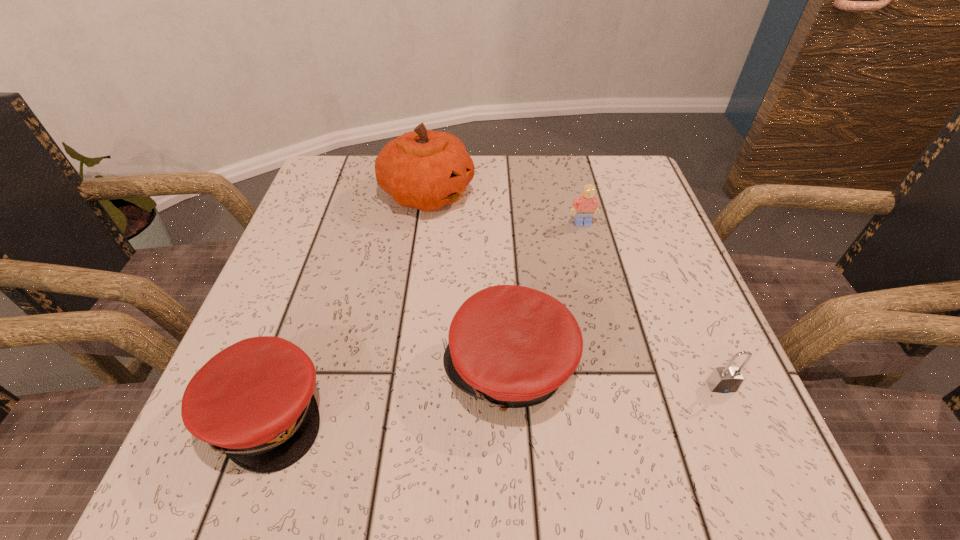
Where is `free space located on the front-facing side of the shorter cap`? The image size is (960, 540). free space located on the front-facing side of the shorter cap is located at coordinates (473, 414).

Identify the location of object that is at the far edge. (423, 169).

I want to click on object at the left edge, so click(254, 400).

Identify the location of Lego positioned at the right edge. This screenshot has width=960, height=540. (586, 205).

Image resolution: width=960 pixels, height=540 pixels. I want to click on padlock that is at the right edge, so click(727, 379).

Image resolution: width=960 pixels, height=540 pixels. In order to click on object located in the near left corner section of the desktop in this screenshot , I will do `click(254, 400)`.

I want to click on vacant space at the far edge of the desktop, so click(x=493, y=176).

The image size is (960, 540). Find the location of `vacant space at the near edge`. vacant space at the near edge is located at coordinates (531, 427).

In order to click on free space at the left edge of the desktop in this screenshot , I will do `click(274, 328)`.

Locate an element on the screen. The height and width of the screenshot is (540, 960). blank space at the right edge is located at coordinates (666, 339).